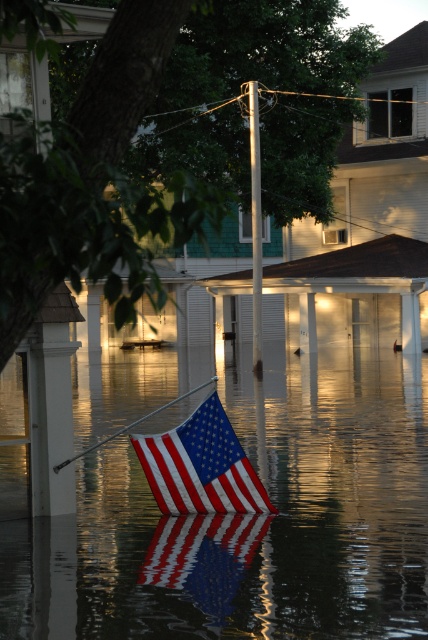
You are a drone operator tasked with capturing aerial footage of the flooded area. You need to ensure the american flag at center is visible in your shot. Given that your drone is currently positioned at point [201,465], which is where the flag is located, should you adjust your position to get a better view of the flag?

The american flag at center is located at point [201,465], so the drone is already positioned directly over the flag. No adjustment is needed for visibility.

You are a photographer trying to capture the reflection of the American flag in the water. Based on the scene, can you determine if the reflective water at center is positioned in a way that allows you to see the reflection of the american flag at center?

The reflective water at center is in front of the american flag at center, so the reflection would not be visible because the water is blocking the direct line of sight between the flag and the photographer.